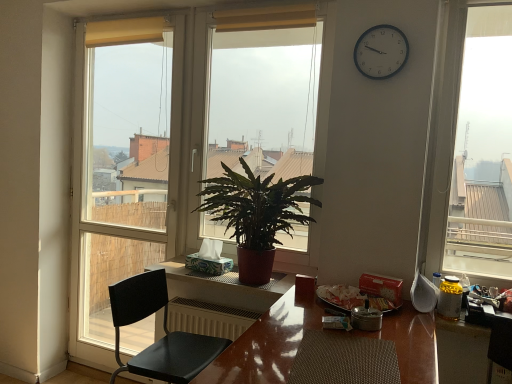
What is the approximate height of matte glass window at center, the second window in the left-to-right sequence?

matte glass window at center, the second window in the left-to-right sequence, is 1.39 meters tall.

This screenshot has height=384, width=512. I want to click on white plastic clock at upper right, so click(x=381, y=52).

What is the approximate height of black matte chair at left?

black matte chair at left is 23.65 inches tall.

What is the approximate width of transparent glass window at left, acting as the 1th window starting from the left?

transparent glass window at left, acting as the 1th window starting from the left, is 8.69 inches in width.

Where is `transparent glass window at left, acting as the 1th window starting from the left`? transparent glass window at left, acting as the 1th window starting from the left is located at coordinates (123, 162).

At what (x,y) coordinates should I click in order to perform the action: click on matte glass window at center, which appears as the first window when viewed from the right. Please return your answer as a coordinate pair (x, y). The image size is (512, 384). Looking at the image, I should click on (264, 91).

Is yellow fabric curtain at upper center, which is counted as the 2th curtain, starting from the right, inside or outside of green glossy plant at center?

yellow fabric curtain at upper center, which is counted as the 2th curtain, starting from the right, cannot be found inside green glossy plant at center.

Is yellow fabric curtain at upper center, the 1th curtain viewed from the back, facing away from green glossy plant at center?

No, yellow fabric curtain at upper center, the 1th curtain viewed from the back, is not facing the opposite direction of green glossy plant at center.

From the image's perspective, does yellow fabric curtain at upper center, acting as the 1th curtain starting from the left, appear higher than green glossy plant at center?

Yes, from the image's perspective, yellow fabric curtain at upper center, acting as the 1th curtain starting from the left, is over green glossy plant at center.

Which of these two, yellow fabric curtain at upper center, acting as the 1th curtain starting from the left, or green glossy plant at center, is thinner?

yellow fabric curtain at upper center, acting as the 1th curtain starting from the left, is thinner.

From the image's perspective, would you say matte brown table at center, arranged as the 1th table when viewed from the back, is positioned over transparent glass window at left, acting as the 1th window starting from the left?

No, from the image's perspective, matte brown table at center, arranged as the 1th table when viewed from the back, is not over transparent glass window at left, acting as the 1th window starting from the left.

Would you say matte brown table at center, arranged as the 1th table when viewed from the back, is outside transparent glass window at left, acting as the 2th window starting from the right?

Absolutely, matte brown table at center, arranged as the 1th table when viewed from the back, is external to transparent glass window at left, acting as the 2th window starting from the right.

Does matte brown table at center, the first table from the top, come in front of transparent glass window at left, acting as the 2th window starting from the right?

Yes, it is in front of transparent glass window at left, acting as the 2th window starting from the right.

Who is smaller, matte brown table at center, arranged as the second table when ordered from the bottom, or transparent glass window at left, acting as the 1th window starting from the left?

matte brown table at center, arranged as the second table when ordered from the bottom, is smaller.

Can you see matte glass window at center, which appears as the first window when viewed from the right, touching green glossy plant at center?

They are not placed beside each other.

Is matte glass window at center, which appears as the first window when viewed from the right, wider than green glossy plant at center?

No.

From a real-world perspective, is matte glass window at center, which appears as the first window when viewed from the right, over green glossy plant at center?

Yes, from a real-world perspective, matte glass window at center, which appears as the first window when viewed from the right, is over green glossy plant at center

Is matte glass window at center, which appears as the first window when viewed from the right, closer to camera compared to green glossy plant at center?

No, matte glass window at center, which appears as the first window when viewed from the right, is behind green glossy plant at center.

From the image's perspective, is green glossy plant at center on top of glossy wooden table at center, acting as the first table starting from the front?

Yes.

Find the location of a particular element. the 2nd table directly beneath the green glossy plant at center (from a real-world perspective) is located at coordinates point(266,345).

Could you tell me if green glossy plant at center is facing glossy wooden table at center, acting as the first table starting from the front?

No, green glossy plant at center is not turned towards glossy wooden table at center, acting as the first table starting from the front.

Between point (227, 210) and point (422, 376), which one is positioned behind?

The point (227, 210) is farther.

Can you tell me how much white plastic clock at upper right and matte brown table at center, marked as the 2th table in a front-to-back arrangement, differ in facing direction?

The angle between the facing direction of white plastic clock at upper right and the facing direction of matte brown table at center, marked as the 2th table in a front-to-back arrangement, is 0.00105 degrees.

Is white plastic clock at upper right taller than matte brown table at center, the first table from the top?

Yes.

Could matte brown table at center, marked as the 2th table in a front-to-back arrangement, be considered to be inside white plastic clock at upper right?

No.

Looking at this image, can you confirm if white plastic clock at upper right is thinner than matte brown table at center, arranged as the 1th table when viewed from the back?

Indeed, white plastic clock at upper right has a lesser width compared to matte brown table at center, arranged as the 1th table when viewed from the back.

Is point (266, 9) positioned behind point (252, 373)?

Yes, point (266, 9) is farther from viewer.

In the image, is yellow fabric curtain at upper center, which appears as the first curtain when viewed from the right, on the left side or the right side of glossy wooden table at center, acting as the 2th table starting from the back?

yellow fabric curtain at upper center, which appears as the first curtain when viewed from the right, is to the left of glossy wooden table at center, acting as the 2th table starting from the back.

Is yellow fabric curtain at upper center, which appears as the first curtain when viewed from the right, looking in the opposite direction of glossy wooden table at center, acting as the first table starting from the front?

yellow fabric curtain at upper center, which appears as the first curtain when viewed from the right, is not turned away from glossy wooden table at center, acting as the first table starting from the front.

Which is more to the right, green glossy plant at center or yellow fabric curtain at upper center, which is the 2th curtain in front-to-back order?

Positioned to the right is green glossy plant at center.

From the picture: How different are the orientations of green glossy plant at center and yellow fabric curtain at upper center, acting as the 1th curtain starting from the left, in degrees?

The angular difference between green glossy plant at center and yellow fabric curtain at upper center, acting as the 1th curtain starting from the left, is 0.000304 degrees.

This screenshot has height=384, width=512. I want to click on houseplant lying below the yellow fabric curtain at upper center, which is the 2th curtain in front-to-back order (from the image's perspective), so click(256, 215).

Consider the image. Who is taller, green glossy plant at center or yellow fabric curtain at upper center, which is the 2th curtain in front-to-back order?

With more height is green glossy plant at center.

This screenshot has width=512, height=384. I want to click on the 2nd curtain behind the green glossy plant at center, counting from the anchor's position, so tap(125, 31).

From a real-world perspective, count 1st tables downward from the transparent glass window at left, acting as the 2th window starting from the right, and point to it. Please provide its 2D coordinates.

[(217, 300)]

Looking at the image, which one is located further to matte brown table at center, arranged as the second table when ordered from the bottom, matte glass window at center, which appears as the first window when viewed from the right, or transparent glass window at left, acting as the 1th window starting from the left?

transparent glass window at left, acting as the 1th window starting from the left, is positioned further to the anchor matte brown table at center, arranged as the second table when ordered from the bottom.

Which object lies further to the anchor point white plastic clock at upper right, yellow fabric curtain at upper center, marked as the 2th curtain in a back-to-front arrangement, or glossy wooden table at center, which is the 2th table in top-to-bottom order?

glossy wooden table at center, which is the 2th table in top-to-bottom order, is positioned further to the anchor white plastic clock at upper right.

When comparing their distances from green glossy plant at center, does matte glass window at center, which appears as the first window when viewed from the right, or black matte chair at left seem further?

matte glass window at center, which appears as the first window when viewed from the right, is further to green glossy plant at center.

Consider the image. Considering their positions, is yellow fabric curtain at upper center, which ranks as the first curtain in front-to-back order, positioned closer to black matte chair at left than yellow fabric curtain at upper center, acting as the 1th curtain starting from the left?

yellow fabric curtain at upper center, which ranks as the first curtain in front-to-back order.

Which object lies nearer to the anchor point black matte chair at left, green glossy plant at center or glossy wooden table at center, the 1th table from the bottom?

Based on the image, glossy wooden table at center, the 1th table from the bottom, appears to be nearer to black matte chair at left.

When comparing their distances from matte brown table at center, arranged as the 1th table when viewed from the back, does green glossy plant at center or yellow fabric curtain at upper center, marked as the 2th curtain in a back-to-front arrangement, seem closer?

The object closer to matte brown table at center, arranged as the 1th table when viewed from the back, is green glossy plant at center.

Looking at the image, which one is located further to yellow fabric curtain at upper center, marked as the 2th curtain in a back-to-front arrangement, matte brown table at center, the first table from the top, or green glossy plant at center?

Based on the image, matte brown table at center, the first table from the top, appears to be further to yellow fabric curtain at upper center, marked as the 2th curtain in a back-to-front arrangement.

Estimate the real-world distances between objects in this image. Which object is closer to glossy wooden table at center, which is the 2th table in top-to-bottom order, matte glass window at center, the second window in the left-to-right sequence, or yellow fabric curtain at upper center, which ranks as the first curtain in front-to-back order?

yellow fabric curtain at upper center, which ranks as the first curtain in front-to-back order, is positioned closer to the anchor glossy wooden table at center, which is the 2th table in top-to-bottom order.

What are the coordinates of `clock that lies between yellow fabric curtain at upper center, the 1th curtain viewed from the back, and glossy wooden table at center, which is the 2th table in top-to-bottom order, from top to bottom` in the screenshot? It's located at (381, 52).

Locate an element on the screen. The width and height of the screenshot is (512, 384). chair between yellow fabric curtain at upper center, which appears as the first curtain when viewed from the right, and glossy wooden table at center, acting as the first table starting from the front, in the vertical direction is located at coordinates (164, 331).

You are a GUI agent. You are given a task and a screenshot of the screen. Output one action in this format:
    pyautogui.click(x=<x>, y=<y>)
    Task: Click on the window between yellow fabric curtain at upper center, which is the 2th curtain in front-to-back order, and white plastic clock at upper right from left to right
    The width and height of the screenshot is (512, 384).
    Given the screenshot: What is the action you would take?
    pyautogui.click(x=264, y=91)

At what (x,y) coordinates should I click in order to perform the action: click on curtain between yellow fabric curtain at upper center, acting as the 1th curtain starting from the left, and transparent glass window at left, acting as the 2th window starting from the right, vertically. Please return your answer as a coordinate pair (x, y). Looking at the image, I should click on (266, 18).